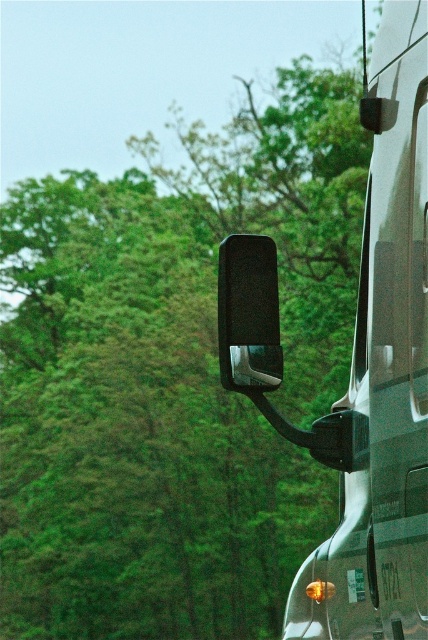
Which is behind, point (383, 307) or point (229, 365)?

Point (229, 365)

Who is taller, metallic silver recreational vehicle at right or black matte car mirror at upper right?

metallic silver recreational vehicle at right

Is point (418, 426) in front of point (276, 372)?

Yes, point (418, 426) is in front of point (276, 372).

You are a GUI agent. You are given a task and a screenshot of the screen. Output one action in this format:
    pyautogui.click(x=<x>, y=<y>)
    Task: Click on the metallic silver recreational vehicle at right
    This screenshot has width=428, height=640.
    Given the screenshot: What is the action you would take?
    pyautogui.click(x=359, y=365)